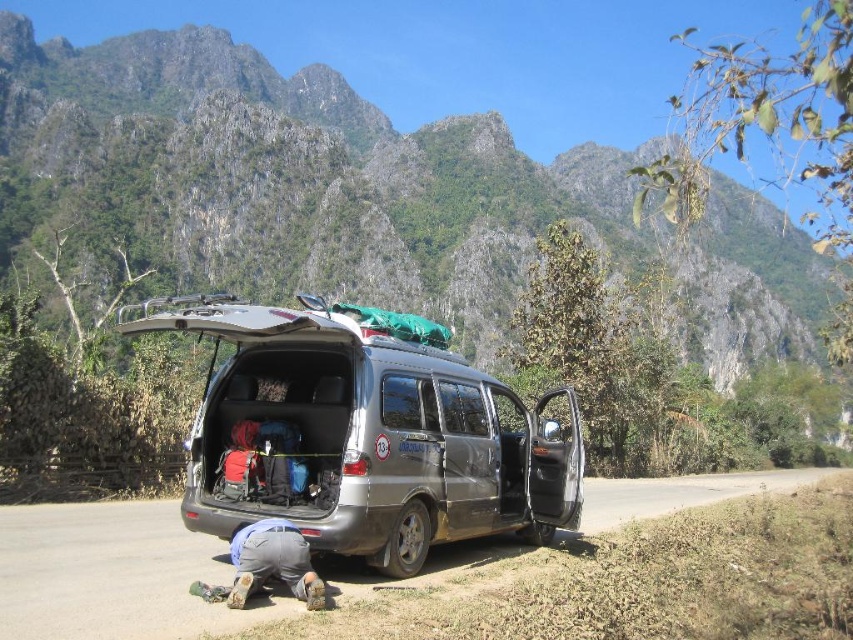
Question: In this image, where is silver metallic van at center located relative to gray fabric squat at lower center?

Choices:
 (A) below
 (B) above

Answer: (B)

Question: Is silver metallic van at center above gray fabric squat at lower center?

Choices:
 (A) no
 (B) yes

Answer: (B)

Question: Estimate the real-world distances between objects in this image. Which object is closer to the gray fabric squat at lower center?

Choices:
 (A) gray asphalt road at lower center
 (B) silver metallic van at center

Answer: (A)

Question: Which object is closer to the camera taking this photo?

Choices:
 (A) gray fabric squat at lower center
 (B) gray asphalt road at lower center
 (C) silver metallic van at center

Answer: (B)

Question: Is gray asphalt road at lower center wider than gray fabric squat at lower center?

Choices:
 (A) no
 (B) yes

Answer: (B)

Question: Based on their relative distances, which object is nearer to the gray fabric squat at lower center?

Choices:
 (A) silver metallic van at center
 (B) gray asphalt road at lower center

Answer: (B)